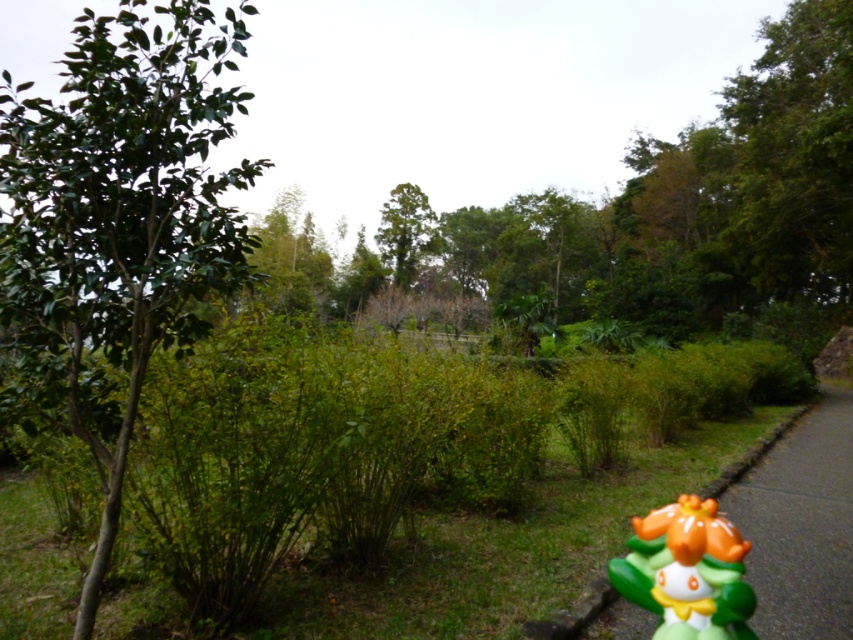
Is green leafy tree at upper center above green rubber toy at lower right?

Yes, green leafy tree at upper center is above green rubber toy at lower right.

Between point (497, 260) and point (639, 552), which one is positioned behind?

The point (497, 260) is more distant.

Does point (463, 237) come closer to viewer compared to point (675, 513)?

No, (463, 237) is further to viewer.

The width and height of the screenshot is (853, 640). What are the coordinates of `green leafy tree at upper center` in the screenshot? It's located at (699, 211).

Is green leafy tree at upper center behind green leafy tree at center?

No.

Is point (666, 184) more distant than point (413, 236)?

No, it is in front of (413, 236).

Is point (631, 141) positioned in front of point (425, 230)?

No.

Identify the location of green leafy tree at upper center. (699, 211).

Can you confirm if green rubber toy at lower right is positioned to the right of green leafy tree at center?

Yes, green rubber toy at lower right is to the right of green leafy tree at center.

Does green rubber toy at lower right have a larger size compared to green leafy tree at center?

Actually, green rubber toy at lower right might be smaller than green leafy tree at center.

Does point (640, 561) come behind point (418, 266)?

That is False.

The height and width of the screenshot is (640, 853). What are the coordinates of `green rubber toy at lower right` in the screenshot? It's located at [x=688, y=572].